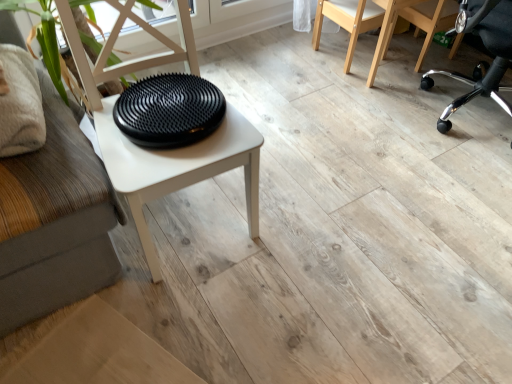
Question: From the image's perspective, is natural wood chair at upper right, the third chair from the right, above or below black rubberized disc at center?

Choices:
 (A) above
 (B) below

Answer: (A)

Question: Considering the positions of natural wood chair at upper right, arranged as the first chair when viewed from the left, and black rubberized disc at center in the image, is natural wood chair at upper right, arranged as the first chair when viewed from the left, wider or thinner than black rubberized disc at center?

Choices:
 (A) wide
 (B) thin

Answer: (B)

Question: Which is farther from the black plastic chair at upper right, which is the 2th chair from right to left?

Choices:
 (A) black plastic office chair at right, the first chair viewed from the right
 (B) natural wood chair at upper right, arranged as the first chair when viewed from the left
 (C) black rubberized disc at center

Answer: (C)

Question: Estimate the real-world distances between objects in this image. Which object is closer to the natural wood chair at upper right, arranged as the first chair when viewed from the left?

Choices:
 (A) black rubberized disc at center
 (B) black plastic chair at upper right, the 2th chair from the left
 (C) black plastic office chair at right, which is the 3th chair in left-to-right order

Answer: (B)